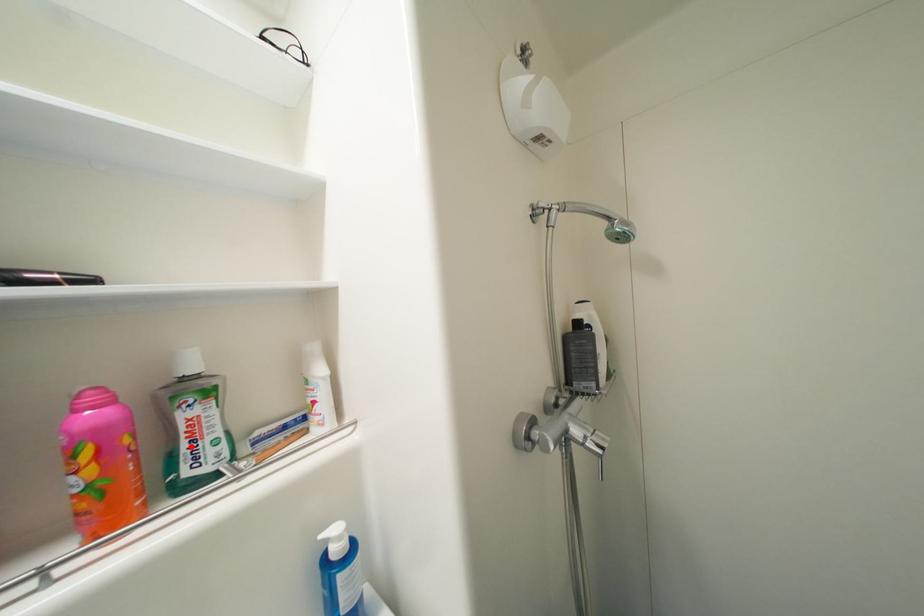
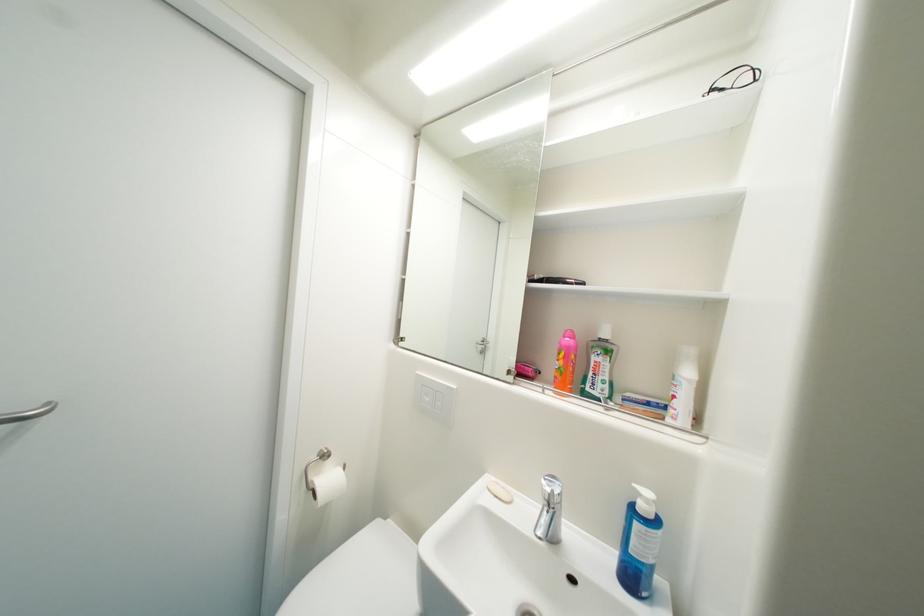
Find the pixel in the second image that matches the highlighted location in the first image.

(598, 376)